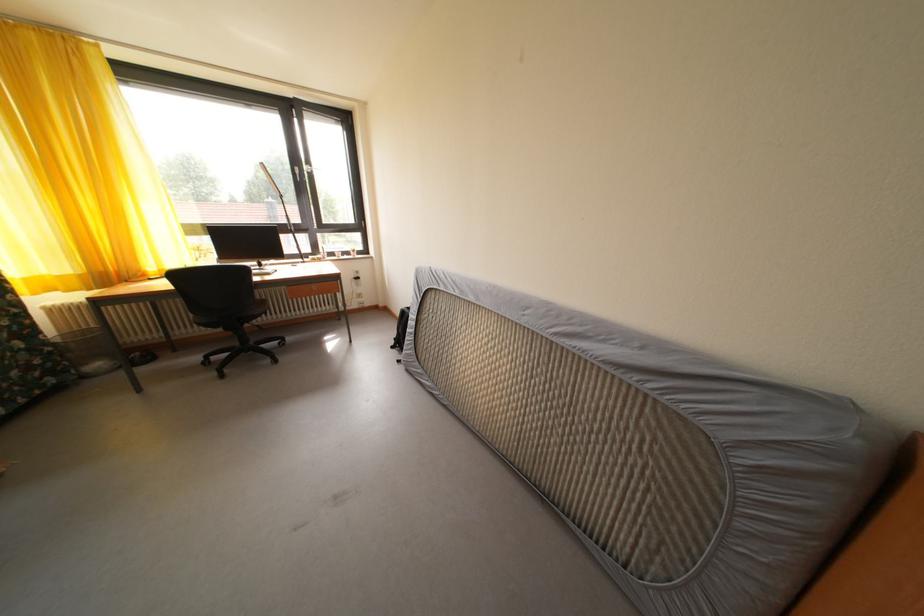
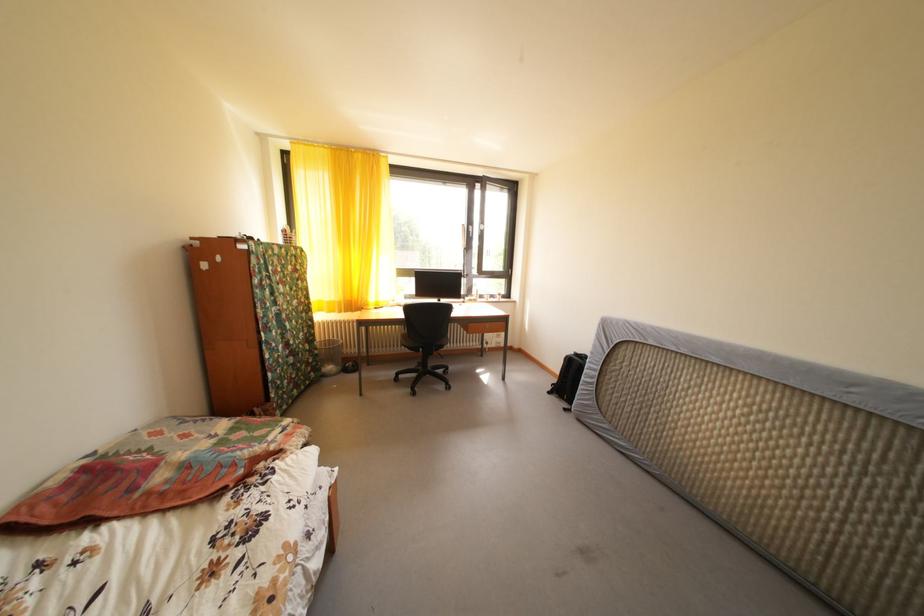
Question: The images are taken continuously from a first-person perspective. In which direction is your viewpoint rotating?

Choices:
 (A) Left
 (B) Right
 (C) Up
 (D) Down

Answer: (A)